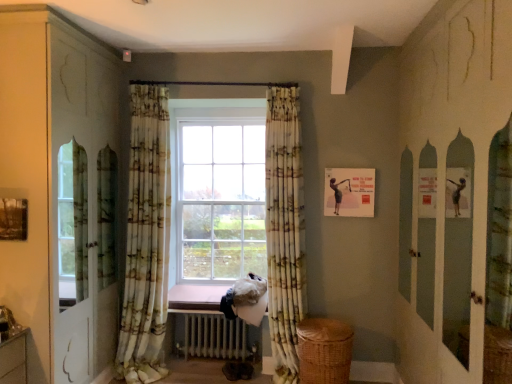
Question: Should I look upward or downward to see printed fabric curtain at center, which appears as the first curtain when viewed from the right?

Choices:
 (A) down
 (B) up

Answer: (A)

Question: Considering the relative positions of white metallic radiator at center and white glossy dresser at left in the image provided, is white metallic radiator at center behind white glossy dresser at left?

Choices:
 (A) no
 (B) yes

Answer: (B)

Question: From the image's perspective, is white metallic radiator at center located beneath white glossy dresser at left?

Choices:
 (A) yes
 (B) no

Answer: (A)

Question: Can you confirm if white metallic radiator at center is bigger than white glossy dresser at left?

Choices:
 (A) yes
 (B) no

Answer: (B)

Question: From a real-world perspective, is white metallic radiator at center below white glossy dresser at left?

Choices:
 (A) yes
 (B) no

Answer: (A)

Question: Can you confirm if white metallic radiator at center is smaller than white glossy dresser at left?

Choices:
 (A) no
 (B) yes

Answer: (B)

Question: Considering the relative positions of white metallic radiator at center and white glossy dresser at left in the image provided, is white metallic radiator at center in front of white glossy dresser at left?

Choices:
 (A) yes
 (B) no

Answer: (B)

Question: Considering the relative positions of floral fabric curtain at center, which appears as the 1th curtain when viewed from the left, and woven brown basket at lower right in the image provided, is floral fabric curtain at center, which appears as the 1th curtain when viewed from the left, to the right of woven brown basket at lower right from the viewer's perspective?

Choices:
 (A) yes
 (B) no

Answer: (B)

Question: Considering the relative sizes of floral fabric curtain at center, placed as the 2th curtain when sorted from right to left, and woven brown basket at lower right in the image provided, is floral fabric curtain at center, placed as the 2th curtain when sorted from right to left, wider than woven brown basket at lower right?

Choices:
 (A) no
 (B) yes

Answer: (A)

Question: Would you consider floral fabric curtain at center, which appears as the 1th curtain when viewed from the left, to be distant from woven brown basket at lower right?

Choices:
 (A) no
 (B) yes

Answer: (B)

Question: Can you confirm if floral fabric curtain at center, which appears as the 1th curtain when viewed from the left, is thinner than woven brown basket at lower right?

Choices:
 (A) yes
 (B) no

Answer: (A)

Question: Is floral fabric curtain at center, which appears as the 1th curtain when viewed from the left, smaller than woven brown basket at lower right?

Choices:
 (A) yes
 (B) no

Answer: (B)

Question: Can you confirm if floral fabric curtain at center, which appears as the 1th curtain when viewed from the left, is bigger than woven brown basket at lower right?

Choices:
 (A) yes
 (B) no

Answer: (A)

Question: Are matte paper picture frame at upper right and floral fabric curtain at center, which appears as the 1th curtain when viewed from the left, located far from each other?

Choices:
 (A) no
 (B) yes

Answer: (B)